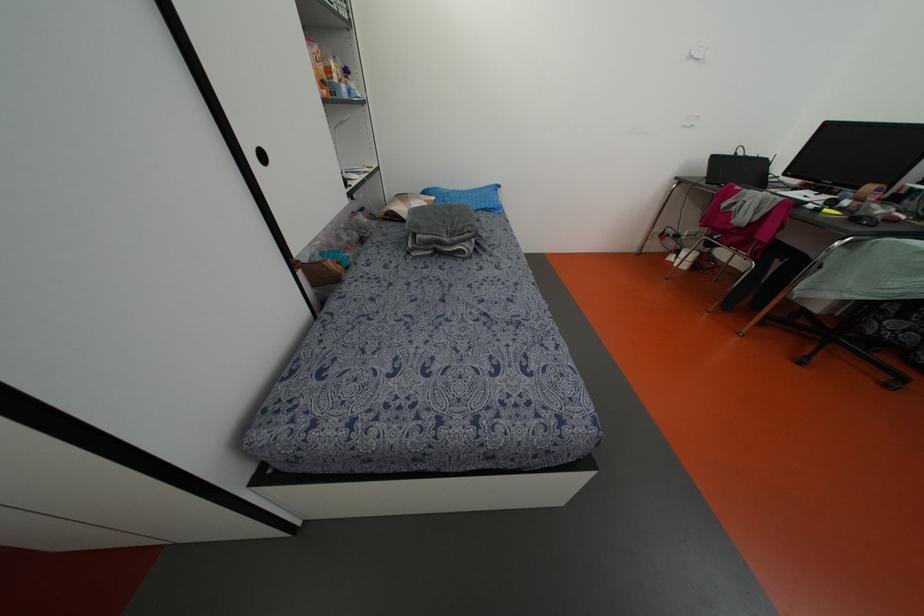
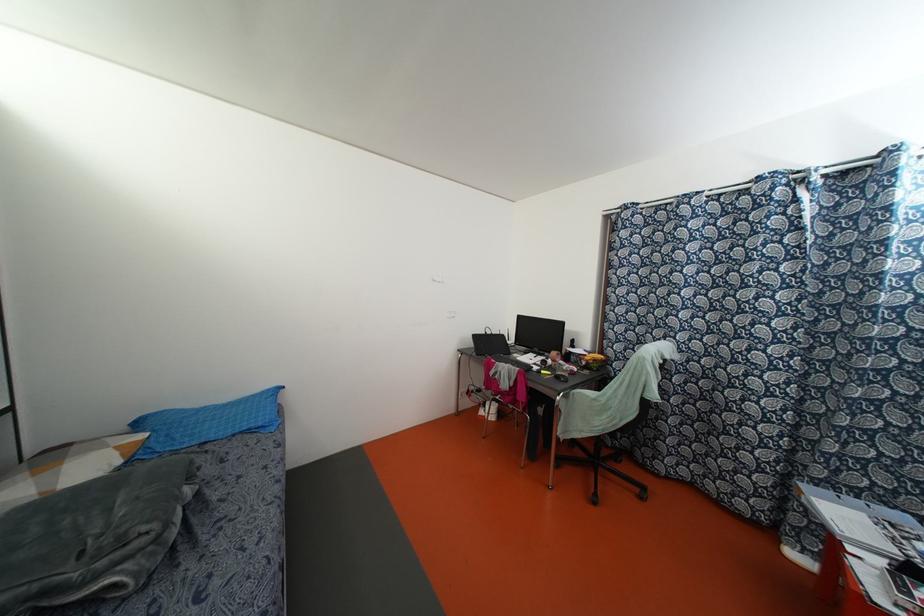
The point at (x=492, y=206) is marked in the first image. Where is the corresponding point in the second image?

(259, 424)